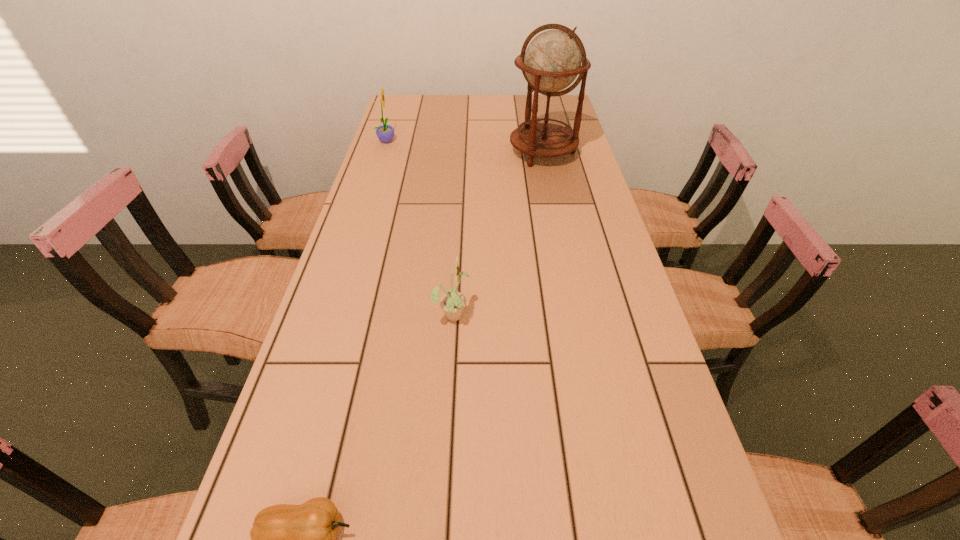
This screenshot has width=960, height=540. Identify the location of the tallest object. (552, 61).

This screenshot has width=960, height=540. What are the coordinates of `globe` in the screenshot? It's located at (552, 61).

Locate an element on the screen. The height and width of the screenshot is (540, 960). the left sunflower is located at coordinates (385, 133).

At what (x,y) coordinates should I click in order to perform the action: click on the second nearest object. Please return your answer as a coordinate pair (x, y). This screenshot has width=960, height=540. Looking at the image, I should click on (452, 302).

The image size is (960, 540). I want to click on the nearer sunflower, so click(452, 302).

The width and height of the screenshot is (960, 540). What are the coordinates of `free space located 0.060m on the surface of the tallest object` in the screenshot? It's located at (548, 180).

You are a GUI agent. You are given a task and a screenshot of the screen. Output one action in this format:
    pyautogui.click(x=<x>, y=<y>)
    Task: Click on the blank area located on the front-facing side of the left sunflower
    The image size is (960, 540).
    Given the screenshot: What is the action you would take?
    pyautogui.click(x=423, y=140)

Find the location of a particular element. vacant area situated on the front-facing side of the third farthest object is located at coordinates (523, 314).

Identify the location of object that is at the left edge. (385, 133).

This screenshot has width=960, height=540. What are the coordinates of `object present at the right edge` in the screenshot? It's located at (552, 61).